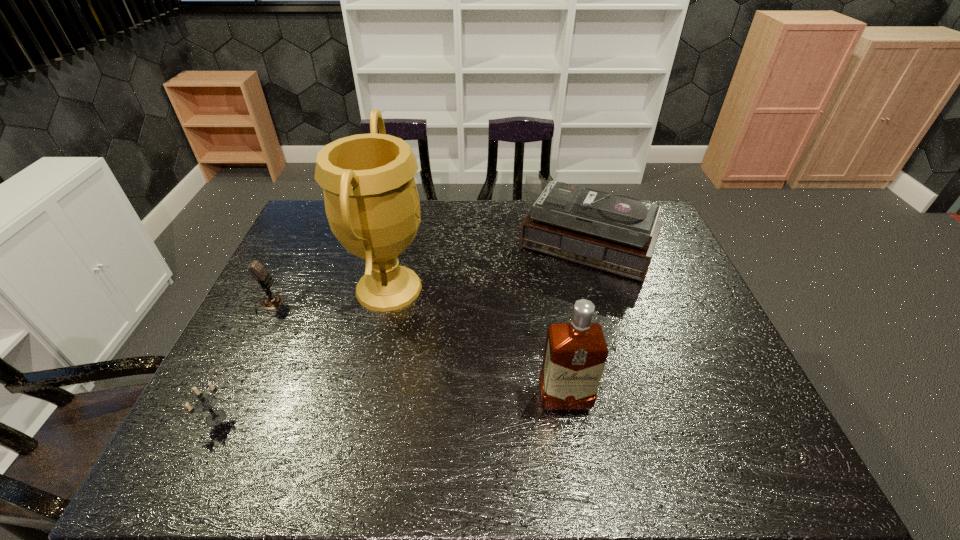
At what (x,y) coordinates should I click in order to perform the action: click on free spot located 0.310m on the back of the candle holder. Please return your answer as a coordinate pair (x, y). Looking at the image, I should click on (270, 308).

Where is `object present at the far edge`? This screenshot has width=960, height=540. object present at the far edge is located at coordinates (616, 233).

Where is `microphone that is at the left edge`? microphone that is at the left edge is located at coordinates (256, 269).

I want to click on candle holder located at the left edge, so click(204, 403).

Locate an element on the screen. object at the right edge is located at coordinates (616, 233).

You are a GUI agent. You are given a task and a screenshot of the screen. Output one action in this format:
    pyautogui.click(x=<x>, y=<y>)
    Task: Click on the object at the far right corner
    This screenshot has height=540, width=960.
    Given the screenshot: What is the action you would take?
    pyautogui.click(x=616, y=233)

The image size is (960, 540). I want to click on vacant area at the near edge of the desktop, so click(555, 458).

The height and width of the screenshot is (540, 960). Find the location of `vacant space at the left edge of the desktop`. vacant space at the left edge of the desktop is located at coordinates (252, 353).

Where is `free space at the right edge of the desktop`? free space at the right edge of the desktop is located at coordinates (668, 266).

Locate an element on the screen. This screenshot has height=540, width=960. free location at the far left corner of the desktop is located at coordinates (317, 222).